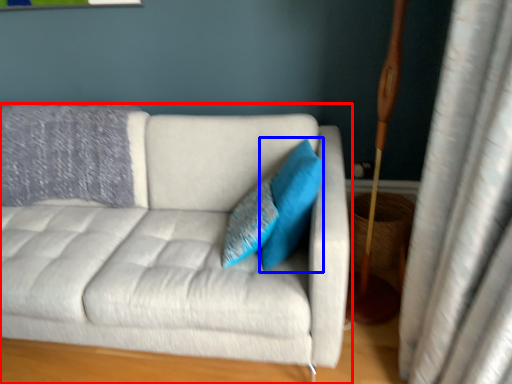
Question: Which of the following is the farthest to the observer, studio couch (highlighted by a red box) or pillow (highlighted by a blue box)?

Choices:
 (A) studio couch
 (B) pillow

Answer: (B)